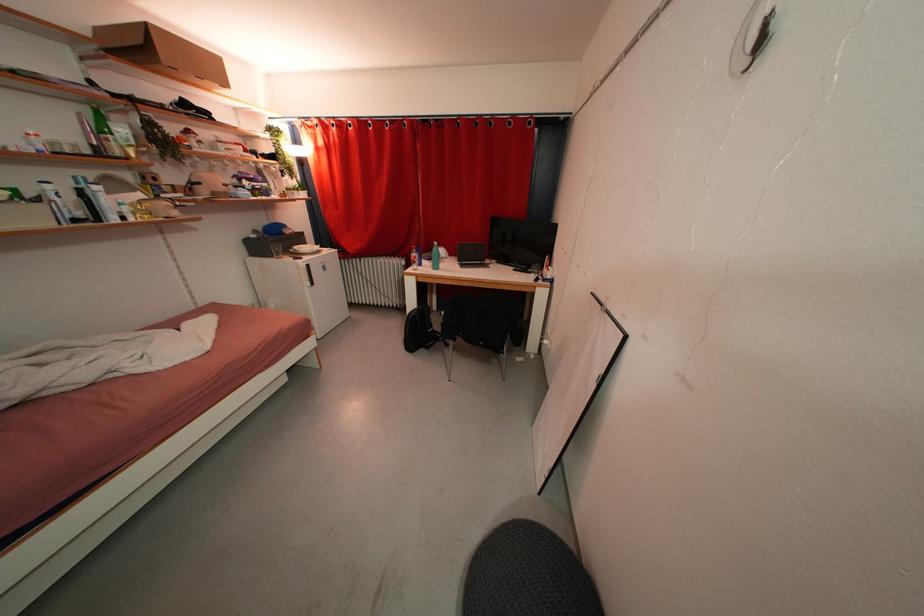
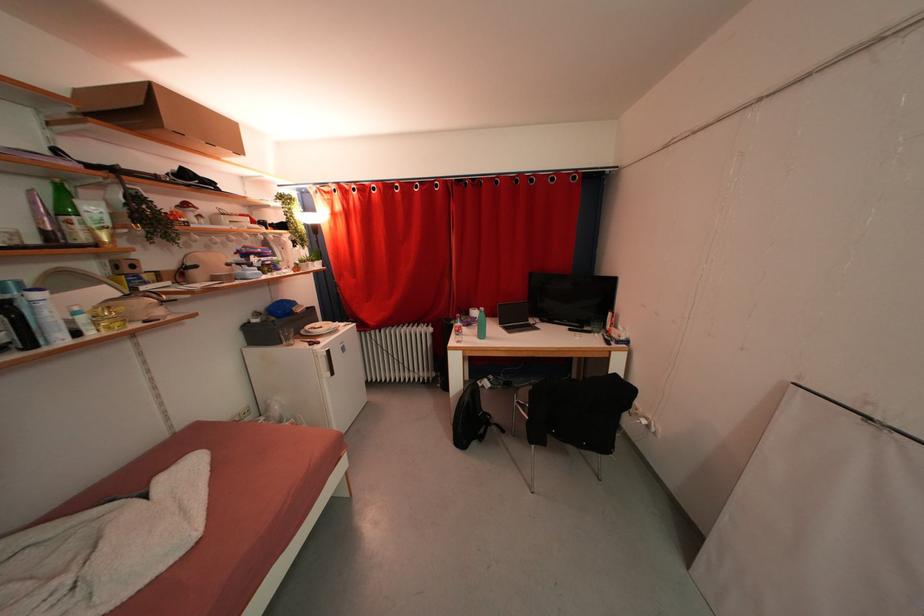
Locate, in the second image, the point that corresponds to (310,246) in the first image.

(322, 323)